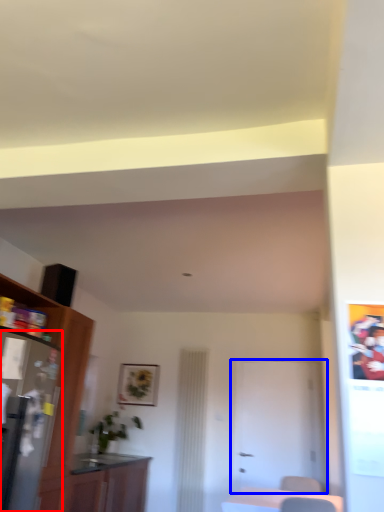
Question: Which object appears closest to the camera in this image, appliance (highlighted by a red box) or door (highlighted by a blue box)?

Choices:
 (A) appliance
 (B) door

Answer: (A)